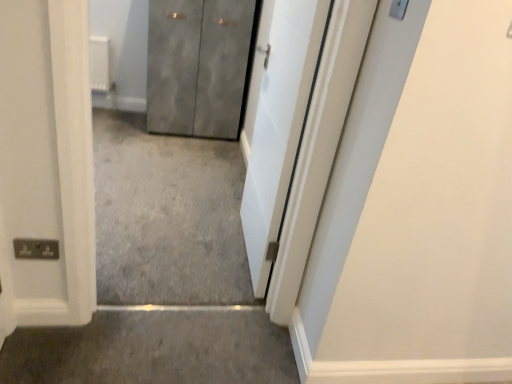
Question: Choose the correct answer: Is metallic gray cabinet at center, which ranks as the 2th door in front-to-back order, inside gray carpet at lower center or outside it?

Choices:
 (A) inside
 (B) outside

Answer: (B)

Question: From a real-world perspective, relative to gray carpet at lower center, is metallic gray cabinet at center, which ranks as the 2th door in front-to-back order, vertically above or below?

Choices:
 (A) above
 (B) below

Answer: (A)

Question: Which object is positioned closest to the white smooth door at center, acting as the second door starting from the left?

Choices:
 (A) gray carpet at lower center
 (B) metallic gray cabinet at center, which is the second door in right-to-left order

Answer: (A)

Question: Estimate the real-world distances between objects in this image. Which object is farther from the metallic gray cabinet at center, which is the second door in right-to-left order?

Choices:
 (A) white smooth door at center, positioned as the second door in back-to-front order
 (B) gray carpet at lower center

Answer: (B)